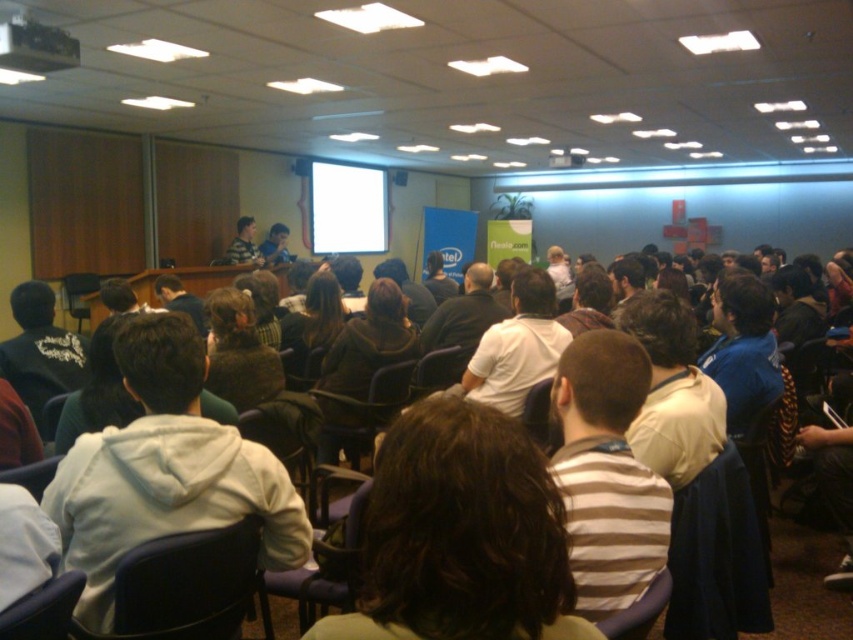
You are sitting in the conference room and notice a person wearing a white shirt at center. Can you determine the exact coordinates of where this person is located?

The white shirt at center is located at point (672, 392).